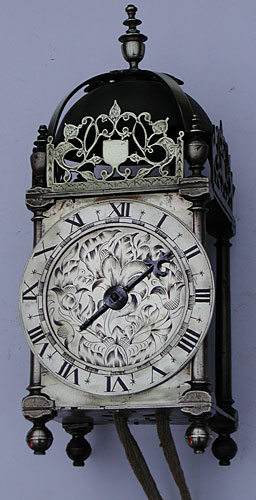
Where is `round base legs of clock`? round base legs of clock is located at coordinates (34, 435), (78, 449), (200, 435), (225, 450).